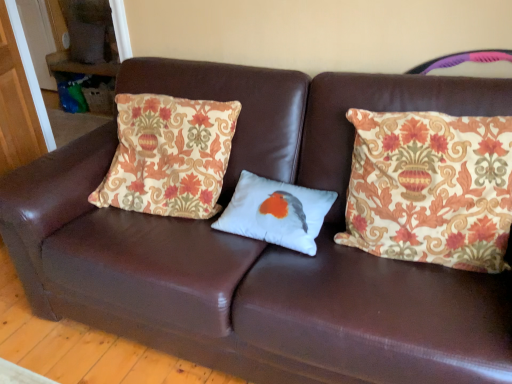
Question: Is floral-patterned fabric pillow at left, the 1th pillow when ordered from left to right, at the right side of white matte pillow with bird design at center, positioned as the second pillow in left-to-right order?

Choices:
 (A) no
 (B) yes

Answer: (A)

Question: From a real-world perspective, is floral-patterned fabric pillow at left, marked as the 3th pillow in a right-to-left arrangement, located higher than white matte pillow with bird design at center, marked as the second pillow in a right-to-left arrangement?

Choices:
 (A) no
 (B) yes

Answer: (B)

Question: Considering the relative sizes of floral-patterned fabric pillow at left, marked as the 3th pillow in a right-to-left arrangement, and white matte pillow with bird design at center, positioned as the second pillow in left-to-right order, in the image provided, is floral-patterned fabric pillow at left, marked as the 3th pillow in a right-to-left arrangement, taller than white matte pillow with bird design at center, positioned as the second pillow in left-to-right order,?

Choices:
 (A) no
 (B) yes

Answer: (B)

Question: Can you confirm if floral-patterned fabric pillow at left, marked as the 3th pillow in a right-to-left arrangement, is smaller than white matte pillow with bird design at center, positioned as the second pillow in left-to-right order?

Choices:
 (A) no
 (B) yes

Answer: (A)

Question: Considering the relative sizes of floral-patterned fabric pillow at left, marked as the 3th pillow in a right-to-left arrangement, and white matte pillow with bird design at center, positioned as the second pillow in left-to-right order, in the image provided, is floral-patterned fabric pillow at left, marked as the 3th pillow in a right-to-left arrangement, wider than white matte pillow with bird design at center, positioned as the second pillow in left-to-right order,?

Choices:
 (A) no
 (B) yes

Answer: (B)

Question: Is point (211, 162) positioned closer to the camera than point (239, 225)?

Choices:
 (A) closer
 (B) farther

Answer: (B)

Question: From the image's perspective, relative to white matte pillow with bird design at center, positioned as the second pillow in left-to-right order, is floral-patterned fabric pillow at left, marked as the 3th pillow in a right-to-left arrangement, above or below?

Choices:
 (A) below
 (B) above

Answer: (B)

Question: Would you say floral-patterned fabric pillow at left, the 1th pillow when ordered from left to right, is to the left or to the right of white matte pillow with bird design at center, positioned as the second pillow in left-to-right order, in the picture?

Choices:
 (A) left
 (B) right

Answer: (A)

Question: Is floral-patterned fabric pillow at left, marked as the 3th pillow in a right-to-left arrangement, bigger or smaller than white matte pillow with bird design at center, positioned as the second pillow in left-to-right order?

Choices:
 (A) big
 (B) small

Answer: (A)

Question: Considering the positions of point (370, 182) and point (136, 155), is point (370, 182) closer or farther from the camera than point (136, 155)?

Choices:
 (A) closer
 (B) farther

Answer: (A)

Question: From their relative heights in the image, would you say patterned fabric pillow at right, acting as the 1th pillow starting from the right, is taller or shorter than floral-patterned fabric pillow at left, marked as the 3th pillow in a right-to-left arrangement?

Choices:
 (A) short
 (B) tall

Answer: (B)

Question: Choose the correct answer: Is patterned fabric pillow at right, positioned as the third pillow in left-to-right order, inside floral-patterned fabric pillow at left, the 1th pillow when ordered from left to right, or outside it?

Choices:
 (A) outside
 (B) inside

Answer: (A)

Question: In the image, is patterned fabric pillow at right, acting as the 1th pillow starting from the right, positioned in front of or behind floral-patterned fabric pillow at left, the 1th pillow when ordered from left to right?

Choices:
 (A) front
 (B) behind

Answer: (A)

Question: From a real-world perspective, is patterned fabric pillow at right, acting as the 1th pillow starting from the right, physically located above or below white matte pillow with bird design at center, positioned as the second pillow in left-to-right order?

Choices:
 (A) above
 (B) below

Answer: (A)

Question: In terms of width, does patterned fabric pillow at right, acting as the 1th pillow starting from the right, look wider or thinner when compared to white matte pillow with bird design at center, marked as the second pillow in a right-to-left arrangement?

Choices:
 (A) thin
 (B) wide

Answer: (B)